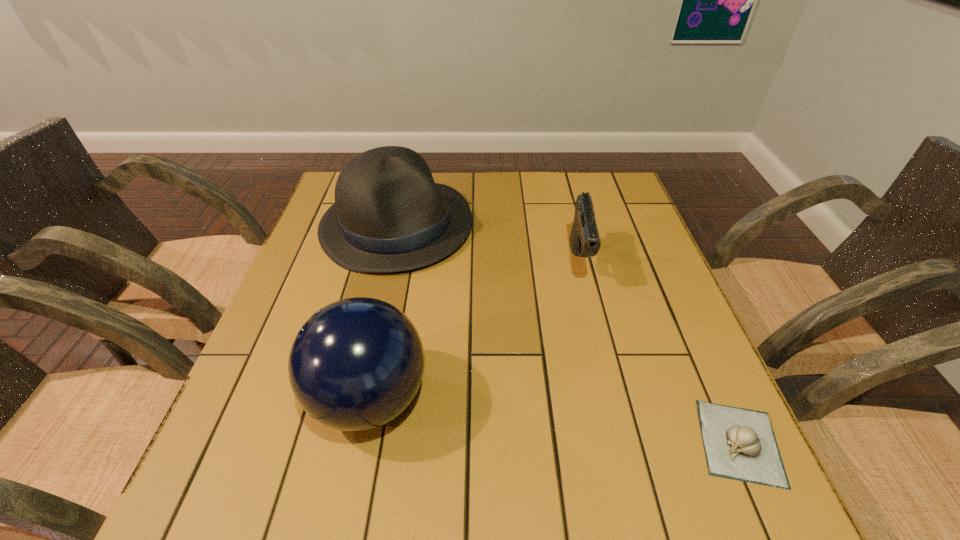
Identify the location of vacant space located on the front-facing side of the bowler hat. Image resolution: width=960 pixels, height=540 pixels. (514, 340).

You are a GUI agent. You are given a task and a screenshot of the screen. Output one action in this format:
    pyautogui.click(x=<x>, y=<y>)
    Task: Click on the free space located 0.310m on the front-facing side of the bowler hat
    
    Given the screenshot: What is the action you would take?
    pyautogui.click(x=520, y=346)

This screenshot has width=960, height=540. In order to click on free space located at the barrel of the third object from left to right in this screenshot , I will do `click(589, 314)`.

The image size is (960, 540). In order to click on free spot located 0.100m at the barrel of the third object from left to right in this screenshot , I will do `click(590, 324)`.

Find the location of a particular element. free location located at the barrel of the third object from left to right is located at coordinates (601, 393).

I want to click on object situated at the far edge, so click(x=389, y=215).

Identify the location of bowling ball positioned at the near edge. (356, 364).

Identify the location of garlic situated at the near edge. This screenshot has height=540, width=960. pyautogui.click(x=740, y=444).

Where is `bowling ball present at the left edge`? The width and height of the screenshot is (960, 540). bowling ball present at the left edge is located at coordinates (356, 364).

Where is `bowler hat located at the left edge`? The height and width of the screenshot is (540, 960). bowler hat located at the left edge is located at coordinates (389, 215).